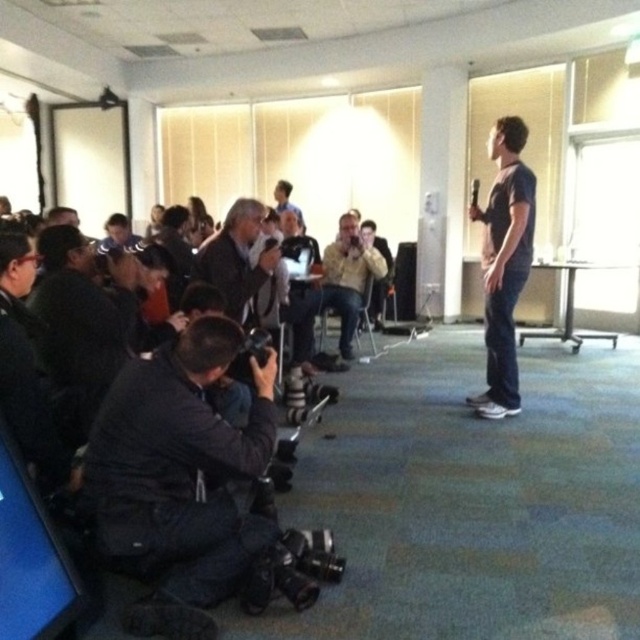
Is dark blue t-shirt at center thinner than light brown leather jacket at center?

Correct, dark blue t-shirt at center's width is less than light brown leather jacket at center's.

Does dark blue t-shirt at center have a greater width compared to light brown leather jacket at center?

In fact, dark blue t-shirt at center might be narrower than light brown leather jacket at center.

The height and width of the screenshot is (640, 640). What do you see at coordinates (504, 262) in the screenshot?
I see `dark blue t-shirt at center` at bounding box center [504, 262].

Locate an element on the screen. The width and height of the screenshot is (640, 640). dark blue t-shirt at center is located at coordinates (504, 262).

Is black fabric camera at lower left below dark blue t-shirt at center?

Correct, black fabric camera at lower left is located below dark blue t-shirt at center.

Is black fabric camera at lower left shorter than dark blue t-shirt at center?

Correct, black fabric camera at lower left is not as tall as dark blue t-shirt at center.

Find the location of `black fabric camera at lower left`. black fabric camera at lower left is located at coordinates (177, 477).

Who is more forward, [499,410] or [250,573]?

Point [250,573] is more forward.

From the picture: Who is lower down, dark blue t-shirt at center or black rubber video camera at lower center?

black rubber video camera at lower center is below.

What do you see at coordinates (504, 262) in the screenshot? I see `dark blue t-shirt at center` at bounding box center [504, 262].

Image resolution: width=640 pixels, height=640 pixels. I want to click on dark blue t-shirt at center, so click(x=504, y=262).